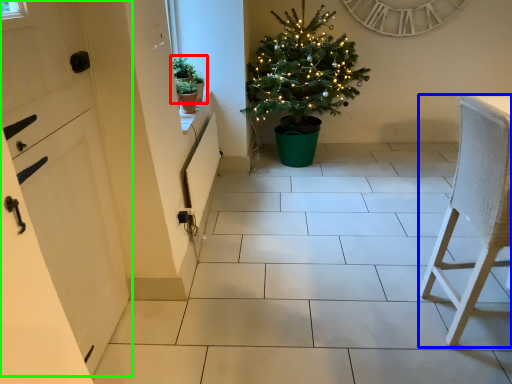
Question: Considering the real-world distances, which object is farthest from houseplant (highlighted by a red box)? furniture (highlighted by a blue box) or door (highlighted by a green box)?

Choices:
 (A) furniture
 (B) door

Answer: (A)